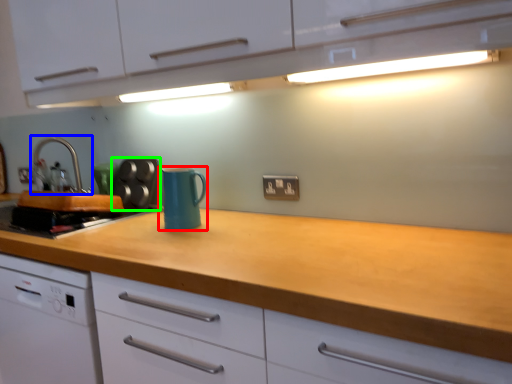
Question: Considering the real-world distances, which object is farthest from kitchen appliance (highlighted by a red box)? tap (highlighted by a blue box) or appliance (highlighted by a green box)?

Choices:
 (A) tap
 (B) appliance

Answer: (A)